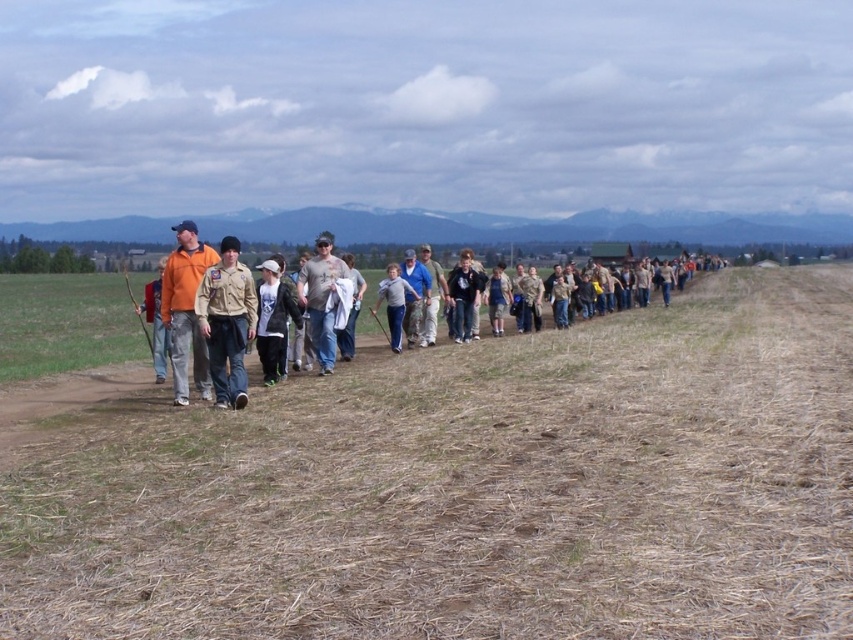
You are a photographer trying to capture a group photo of the white matte shirt at center and dark blue shirt at center. Since you want to ensure both are visible, which person should you position closer to the front to avoid being blocked?

The white matte shirt at center should be positioned closer to the front because it has a lesser height compared to the dark blue shirt at center.

You are part of the group walking in the open field and want to hand a note to the person wearing the khaki uniform at center. If you are currently standing in front of the denim shorts at center, can you directly hand the note without moving past them?

The khaki uniform at center is closer to the viewer than denim shorts at center. Since you are in front of the denim shorts at center, the khaki uniform at center is already between you and the denim shorts. Therefore, you can directly hand the note to the khaki uniform at center without needing to move past the denim shorts at center.